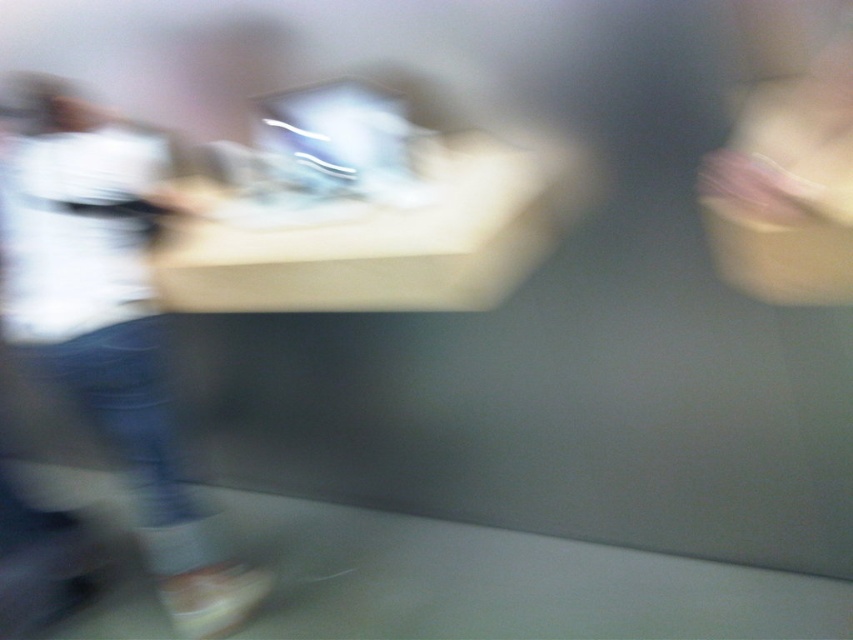
Does blue jeans at left appear on the right side of matte plastic computer at center?

In fact, blue jeans at left is to the left of matte plastic computer at center.

Where is `blue jeans at left`? This screenshot has width=853, height=640. blue jeans at left is located at coordinates (109, 326).